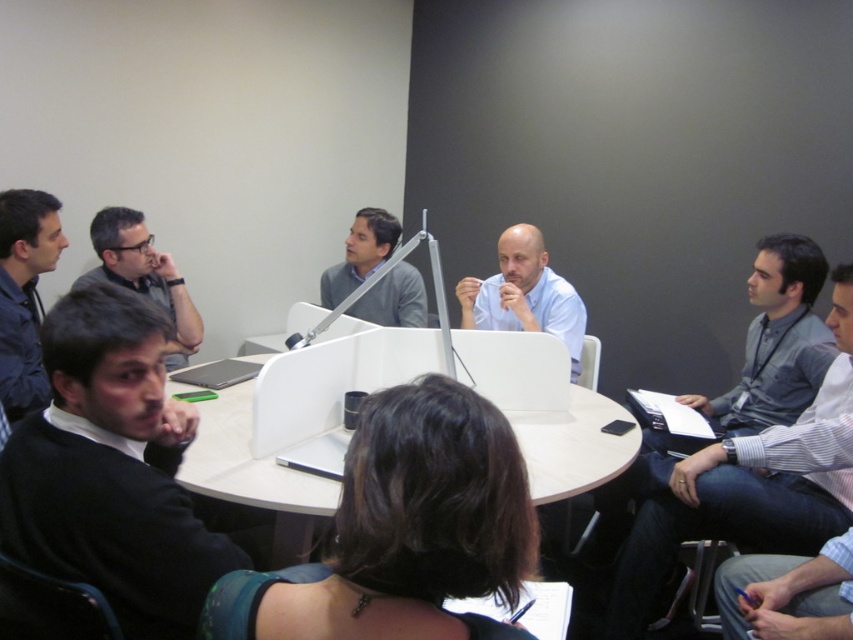
Which is behind, point (30, 337) or point (177, 324)?

The point (177, 324) is behind.

Does dark blue shirt at left have a greater height compared to matte black glasses at upper left?

Indeed, dark blue shirt at left has a greater height compared to matte black glasses at upper left.

Is point (22, 371) positioned behind point (180, 296)?

No, (22, 371) is closer to viewer.

Find the location of a particular element. This screenshot has width=853, height=640. dark blue shirt at left is located at coordinates (24, 292).

The width and height of the screenshot is (853, 640). What are the coordinates of `gray shirt at right` in the screenshot? It's located at tap(776, 340).

Does gray shirt at right have a larger size compared to dark blue shirt at left?

Yes.

Locate an element on the screen. gray shirt at right is located at coordinates (776, 340).

Is black sweater at lower left smaller than gray shirt at right?

Correct, black sweater at lower left occupies less space than gray shirt at right.

Does point (144, 328) come closer to viewer compared to point (766, 305)?

Yes, it is.

At what (x,y) coordinates should I click in order to perform the action: click on black sweater at lower left. Please return your answer as a coordinate pair (x, y). The width and height of the screenshot is (853, 640). Looking at the image, I should click on (111, 468).